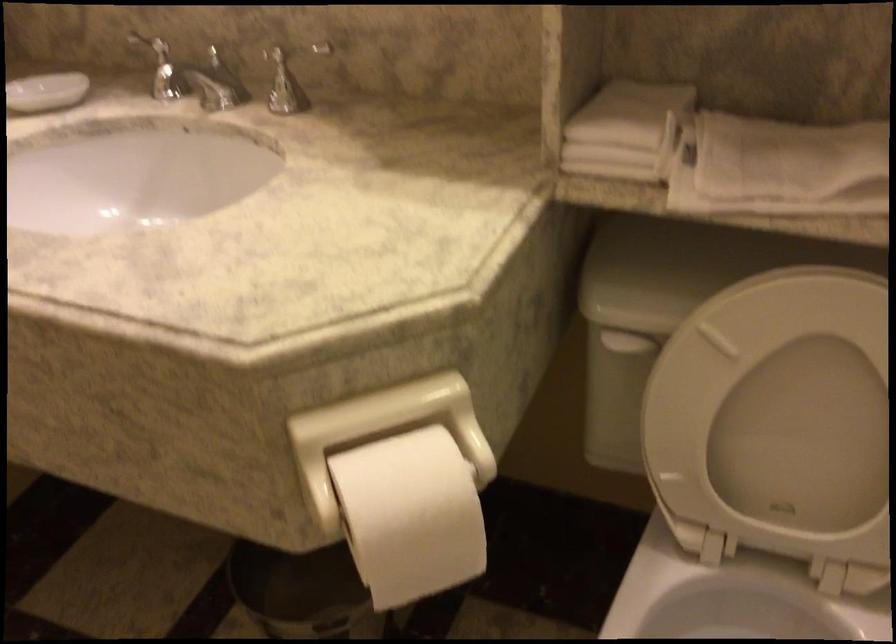
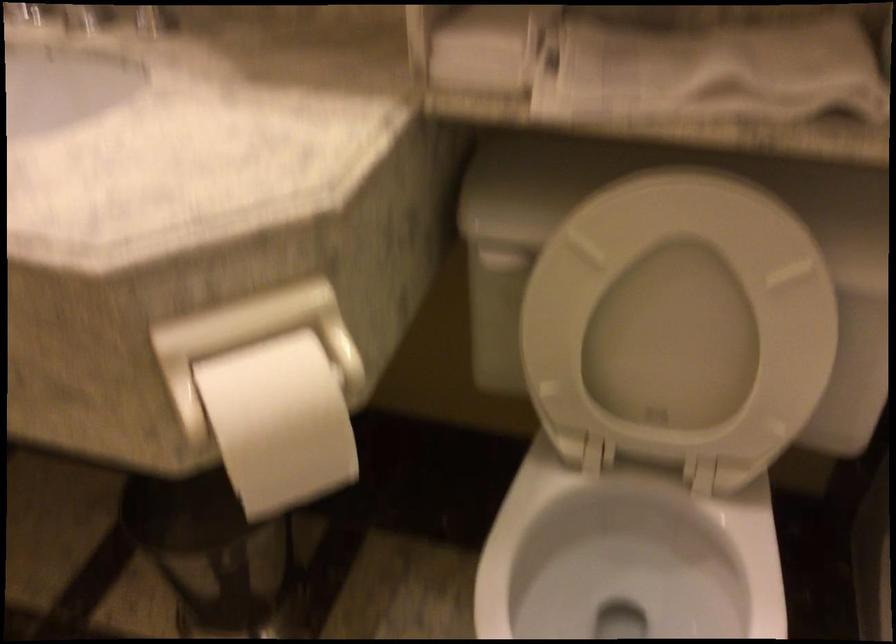
The point at (412, 518) is marked in the first image. Where is the corresponding point in the second image?

(279, 422)